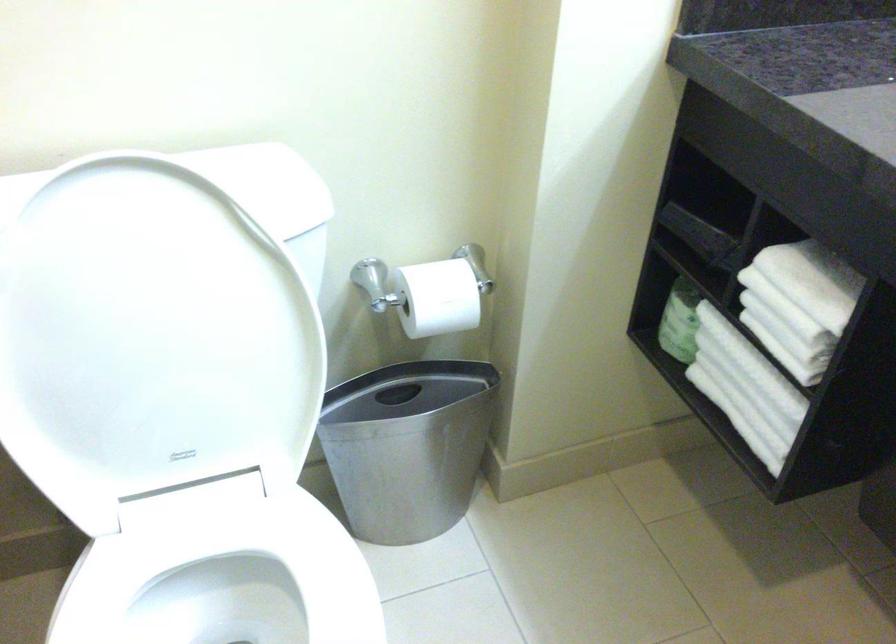
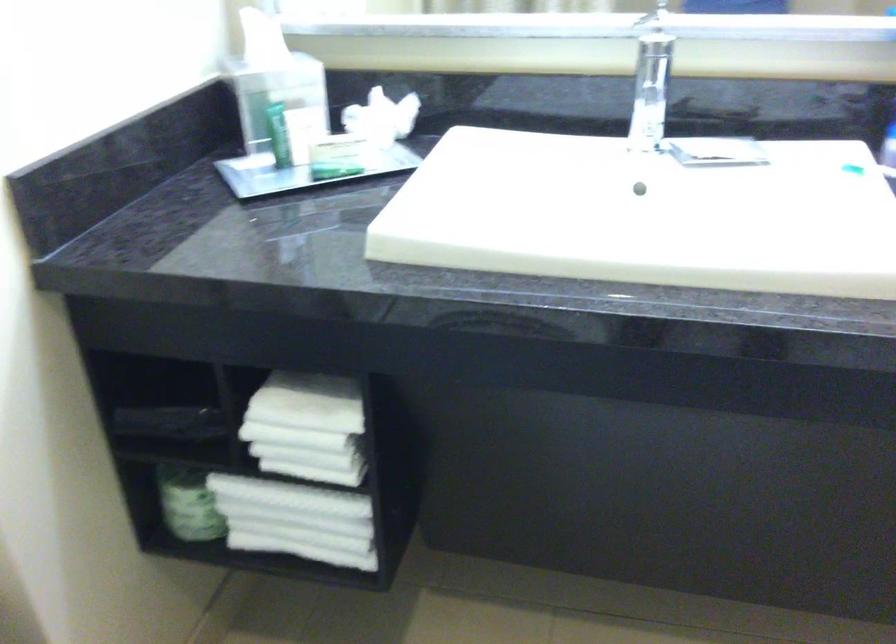
The point at (794, 299) is marked in the first image. Where is the corresponding point in the second image?

(307, 428)